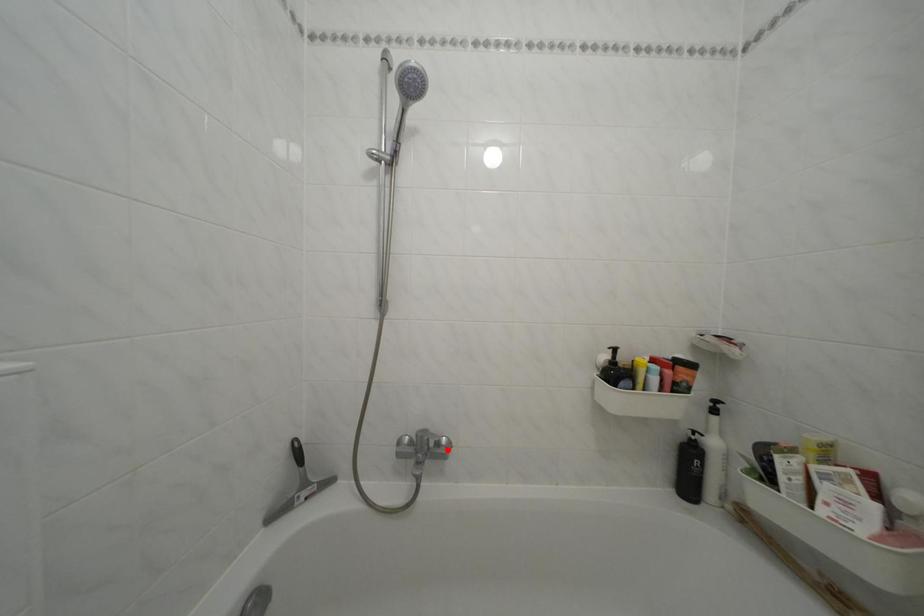
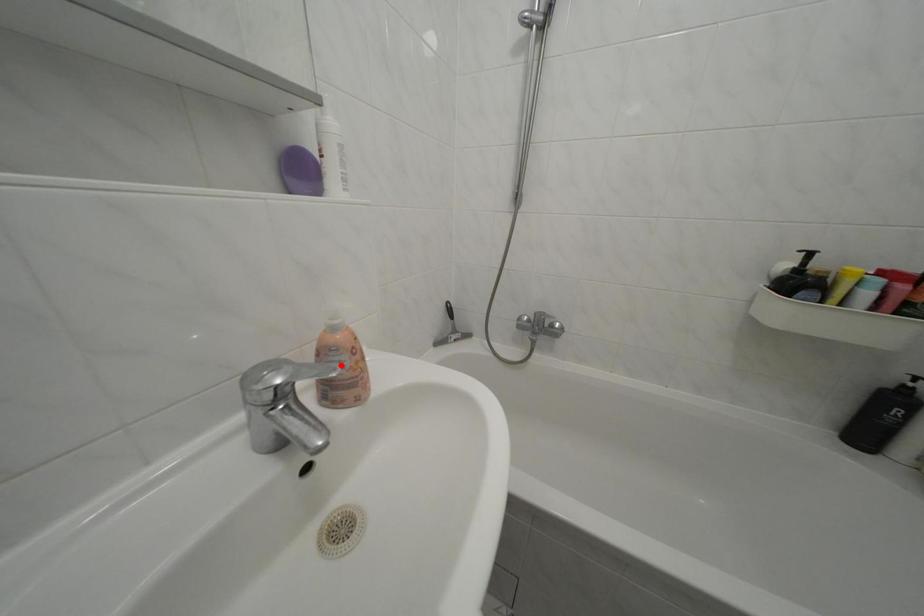
I am providing you with two images of the same scene from different viewpoints. A red point is marked on the first image and another point is marked on the second image. Do the highlighted points in image1 and image2 indicate the same real-world spot?

No